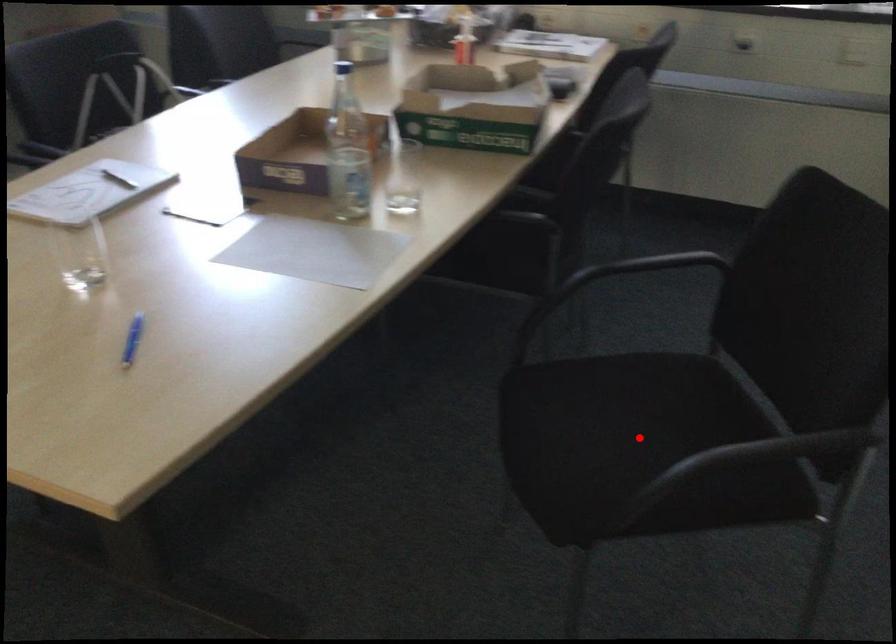
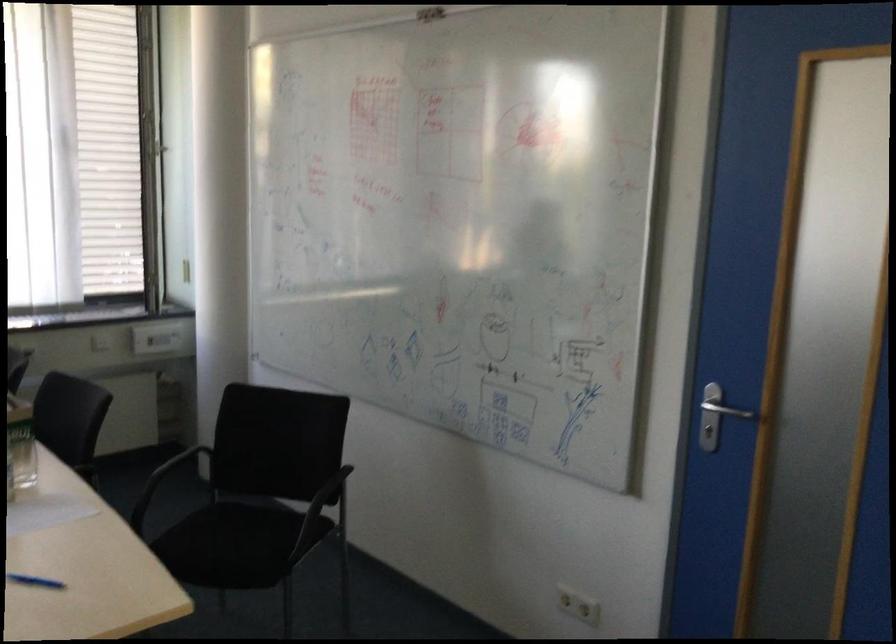
Question: I am providing you with two images of the same scene from different viewpoints. A red point is shown in image1. For the corresponding object point in image2, is it positioned nearer or farther from the camera?

Choices:
 (A) Nearer
 (B) Farther

Answer: (B)